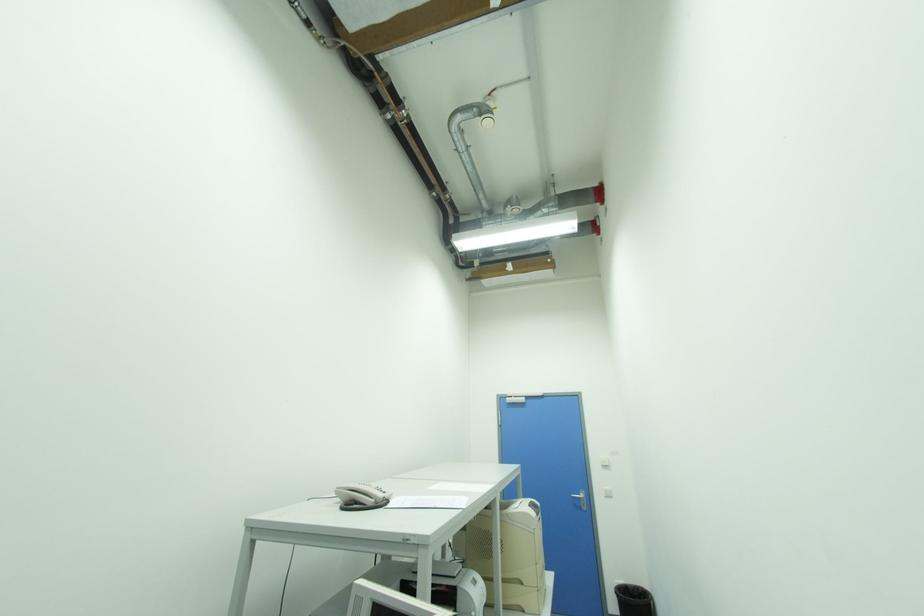
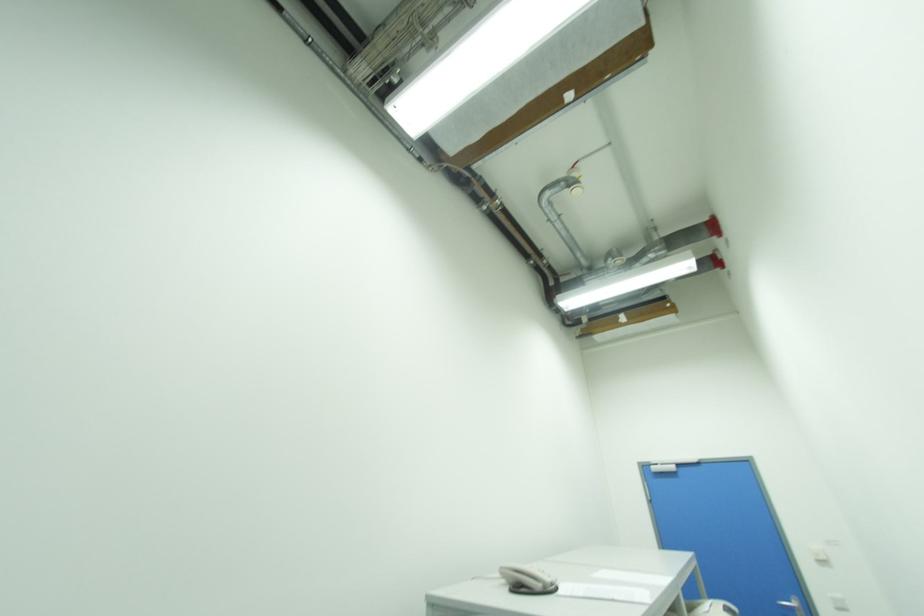
Question: Based on the continuous images, in which direction is the camera rotating? Reply with the corresponding letter.

Choices:
 (A) Left
 (B) Right
 (C) Up
 (D) Down

Answer: (A)